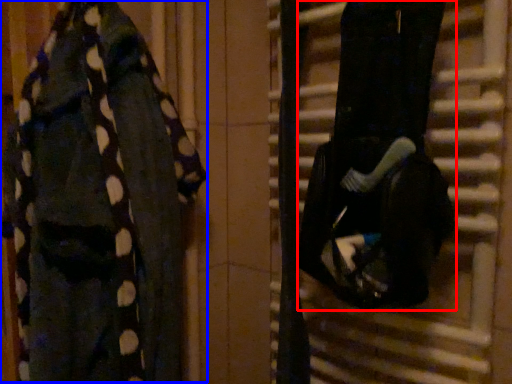
Question: Which object appears farthest to the camera in this image, wide (highlighted by a red box) or underclothes (highlighted by a blue box)?

Choices:
 (A) wide
 (B) underclothes

Answer: (A)